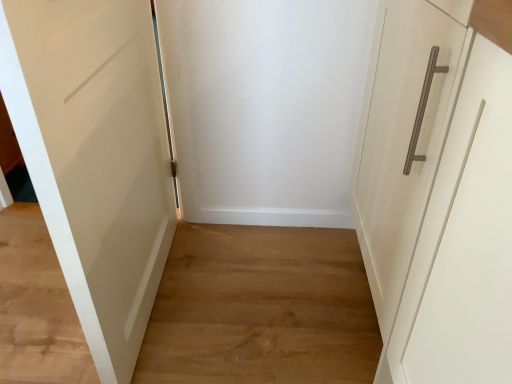
This screenshot has width=512, height=384. In order to click on vacant position to the left of white matte door at left in this screenshot , I will do `click(33, 295)`.